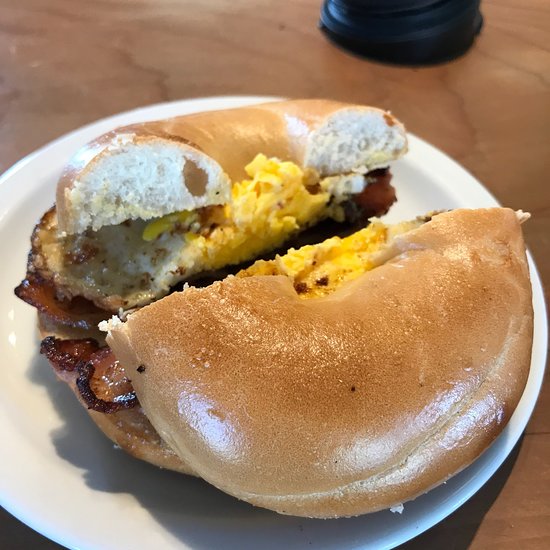
Locate an element on the screen. white plate is located at coordinates (64, 485).